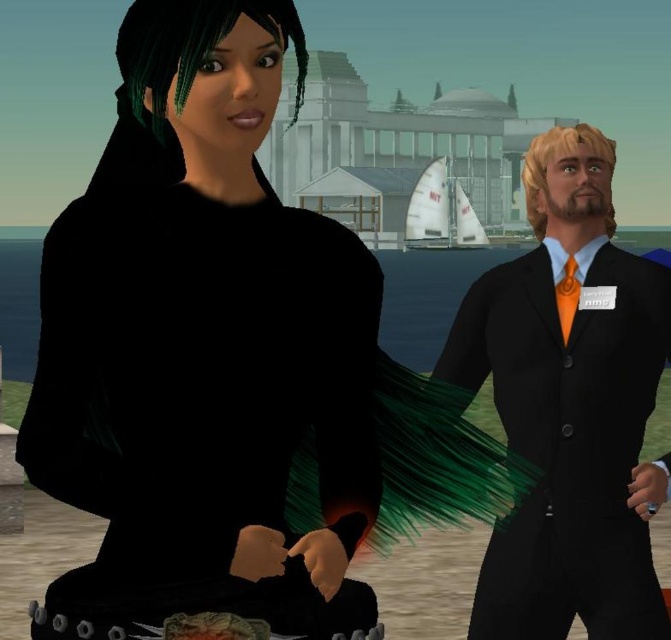
Does matte black dress at left have a lesser width compared to matte black suit at right?

Yes, matte black dress at left is thinner than matte black suit at right.

Which is above, matte black dress at left or matte black suit at right?

matte black dress at left is higher up.

Between point (130, 412) and point (564, 358), which one is positioned in front?

Positioned in front is point (130, 412).

Identify the location of matte black dress at left. This screenshot has width=671, height=640. (203, 349).